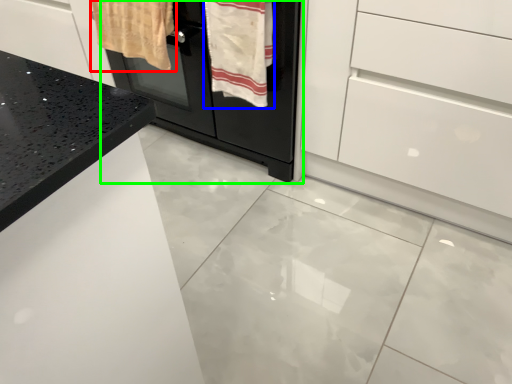
Question: Considering the real-world distances, which object is farthest from bath towel (highlighted by a red box)? bath towel (highlighted by a blue box) or oven (highlighted by a green box)?

Choices:
 (A) bath towel
 (B) oven

Answer: (A)